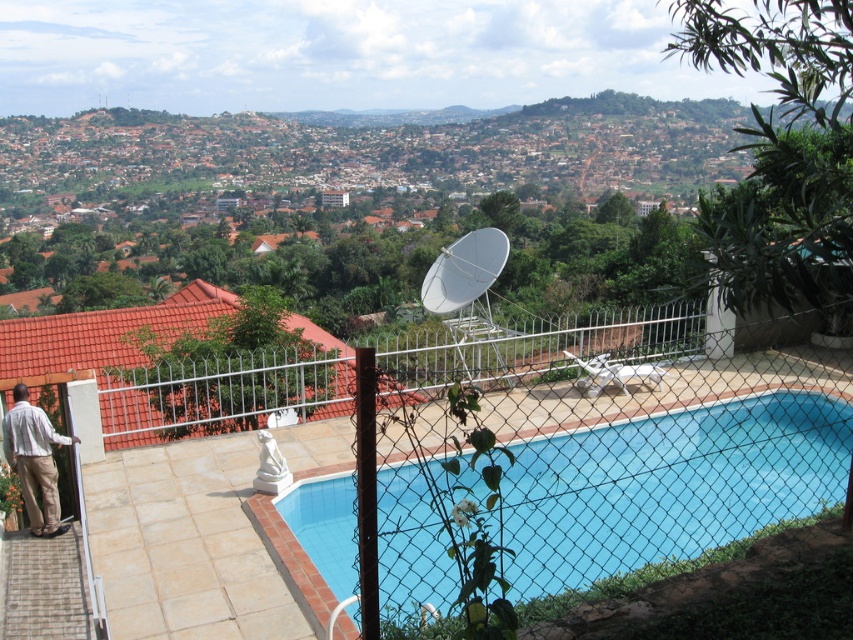
Between blue smooth pool at center and white metal fence at center, which one has more height?

white metal fence at center is taller.

Based on the photo, can you confirm if blue smooth pool at center is bigger than white metal fence at center?

No.

Between point (595, 561) and point (468, 316), which one is positioned behind?

The point (468, 316) is more distant.

The width and height of the screenshot is (853, 640). Find the location of `blue smooth pool at center`. blue smooth pool at center is located at coordinates [666, 486].

Can you confirm if white metal fence at center is positioned above light brown cotton pants at lower left?

Yes, white metal fence at center is above light brown cotton pants at lower left.

Is point (119, 365) in front of point (41, 480)?

No, it is behind (41, 480).

Where is `white metal fence at center`? white metal fence at center is located at coordinates pos(526,348).

Does blue smooth pool at center appear under light brown cotton pants at lower left?

Correct, blue smooth pool at center is located below light brown cotton pants at lower left.

Does blue smooth pool at center have a greater height compared to light brown cotton pants at lower left?

Yes, blue smooth pool at center is taller than light brown cotton pants at lower left.

Is point (618, 522) less distant than point (19, 403)?

No, (618, 522) is behind (19, 403).

Locate an element on the screen. This screenshot has width=853, height=640. blue smooth pool at center is located at coordinates coord(666,486).